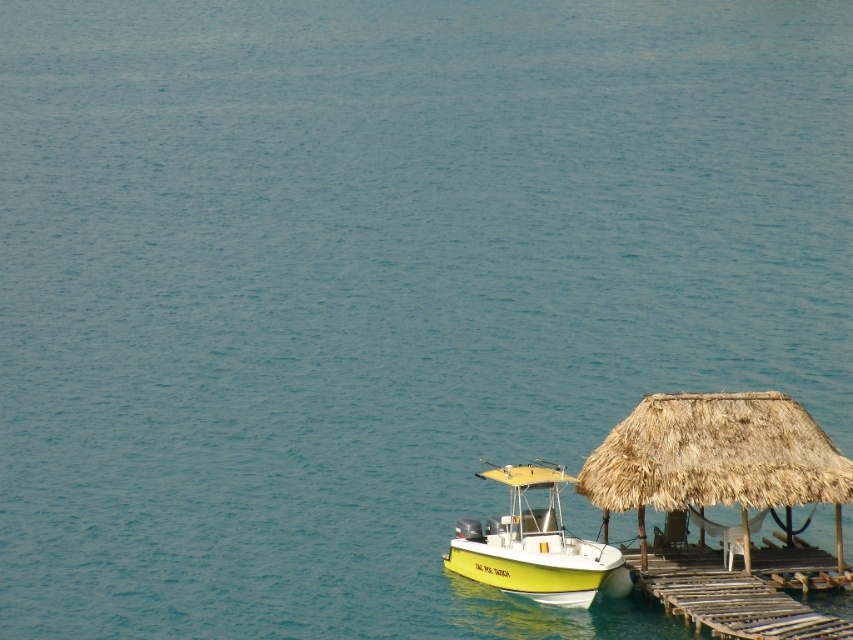
Can you confirm if yellow matte boat at lower right is positioned to the right of wooden planks dock at lower right?

No, yellow matte boat at lower right is not to the right of wooden planks dock at lower right.

Who is lower down, yellow matte boat at lower right or wooden planks dock at lower right?

wooden planks dock at lower right is lower down.

In order to click on yellow matte boat at lower right in this screenshot , I will do `click(532, 545)`.